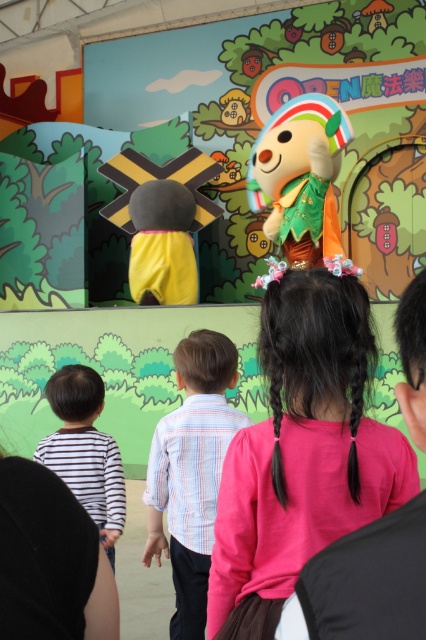
Question: Observing the image, what is the correct spatial positioning of soft plush toy at center in reference to striped cotton shirt at left?

Choices:
 (A) left
 (B) right

Answer: (B)

Question: Which of the following is the closest to the observer?

Choices:
 (A) soft plush toy at center
 (B) pink fabric at center
 (C) striped cotton shirt at left
 (D) striped cotton shirt at center

Answer: (B)

Question: Does pink fabric at center have a larger size compared to striped cotton shirt at left?

Choices:
 (A) no
 (B) yes

Answer: (B)

Question: In this image, where is striped cotton shirt at center located relative to striped cotton shirt at left?

Choices:
 (A) right
 (B) left

Answer: (A)

Question: Which point is closer to the camera?

Choices:
 (A) (190, 460)
 (B) (264, 496)
 (C) (331, 252)

Answer: (B)

Question: Estimate the real-world distances between objects in this image. Which object is farther from the striped cotton shirt at left?

Choices:
 (A) striped cotton shirt at center
 (B) pink fabric at center
 (C) soft plush toy at center

Answer: (C)